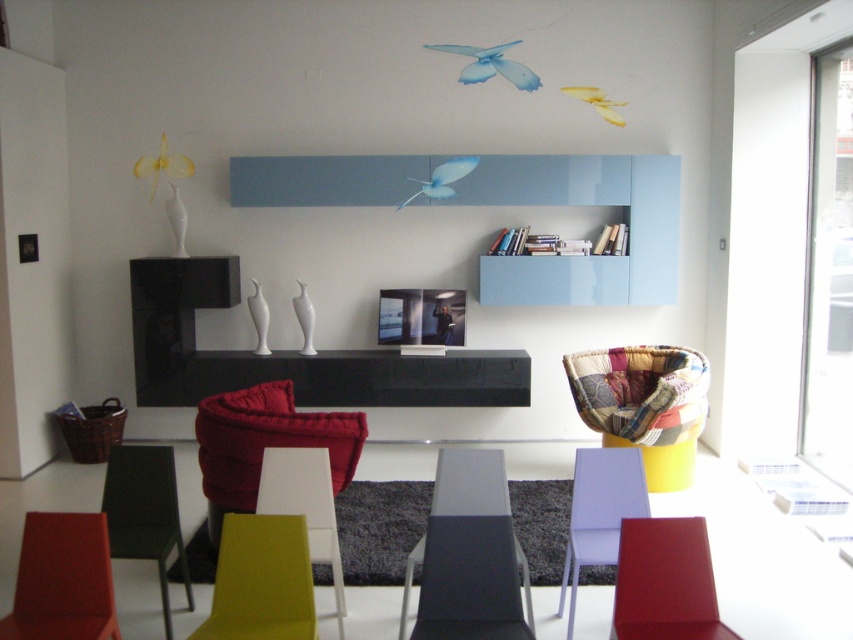
In the scene shown: Can you confirm if velvet red armchair at center is taller than matte purple armchair at center?

Correct, velvet red armchair at center is much taller as matte purple armchair at center.

Consider the image. Does velvet red armchair at center have a smaller size compared to matte purple armchair at center?

No.

This screenshot has height=640, width=853. In order to click on velvet red armchair at center in this screenshot , I will do `click(264, 444)`.

Is patchwork fabric armchair at lower right below matte purple armchair at center?

No, patchwork fabric armchair at lower right is not below matte purple armchair at center.

Is point (637, 442) positioned in front of point (578, 545)?

No, it is not.

Image resolution: width=853 pixels, height=640 pixels. Find the location of `patchwork fabric armchair at lower right`. patchwork fabric armchair at lower right is located at coordinates (643, 404).

Looking at this image, is patchwork fabric armchair at lower right shorter than matte yellow chair at center?

Result: In fact, patchwork fabric armchair at lower right may be taller than matte yellow chair at center.

Does patchwork fabric armchair at lower right have a smaller size compared to matte yellow chair at center?

No, patchwork fabric armchair at lower right is not smaller than matte yellow chair at center.

The width and height of the screenshot is (853, 640). What are the coordinates of `patchwork fabric armchair at lower right` in the screenshot? It's located at (643, 404).